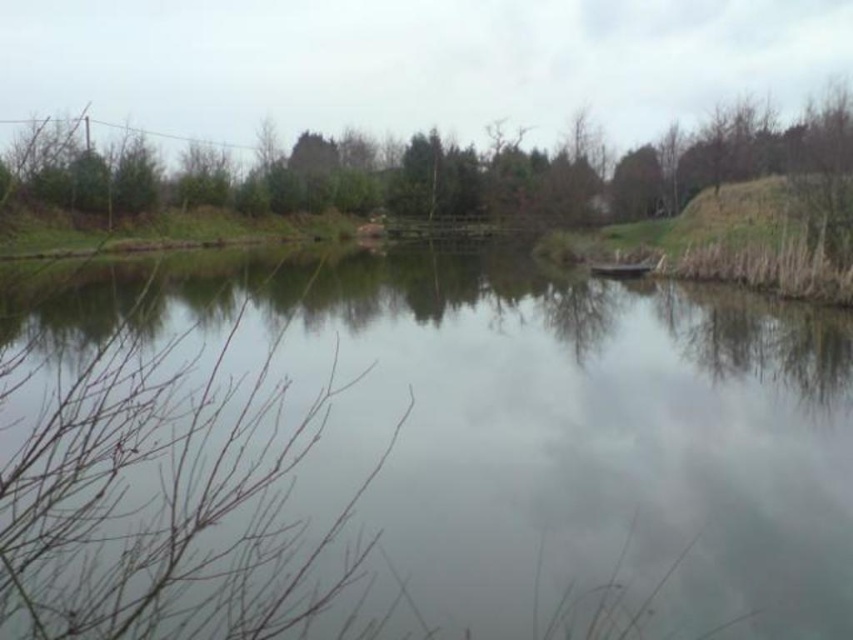
Consider the image. Is transparent water at center taller than green leafy tree at upper center?

No.

Consider the image. Who is taller, transparent water at center or green leafy tree at upper center?

green leafy tree at upper center is taller.

Who is more distant from viewer, (x=231, y=356) or (x=547, y=211)?

Positioned behind is point (x=547, y=211).

Locate an element on the screen. transparent water at center is located at coordinates (527, 426).